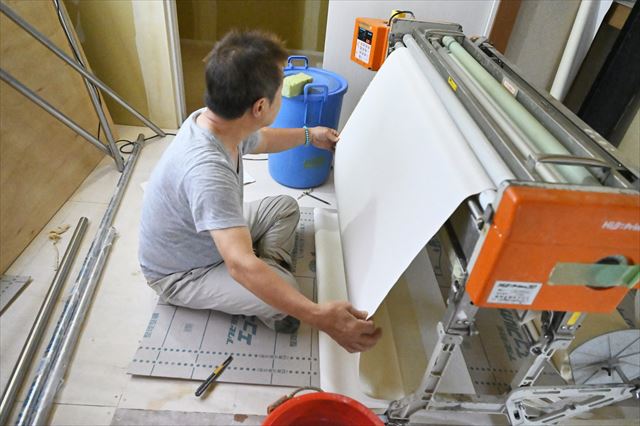
At what (x,y) coordinates should I click in order to perform the action: click on sponge. Please return your answer as a coordinate pair (x, y). This screenshot has width=640, height=426. Looking at the image, I should click on (292, 86).